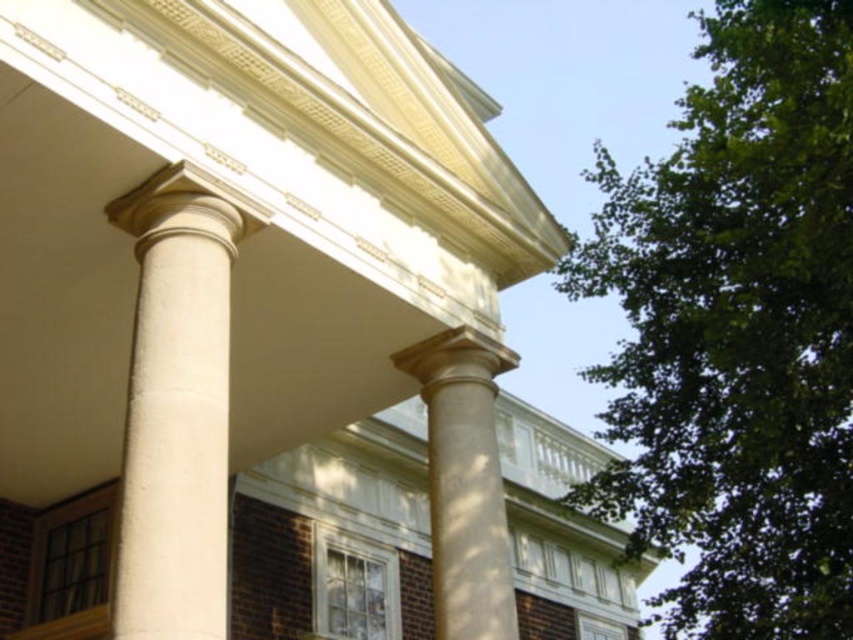
Who is lower down, green leafy tree at upper right or smooth beige column at center?

smooth beige column at center is lower down.

Is green leafy tree at upper right positioned in front of smooth beige column at center?

Yes.

At what (x,y) coordinates should I click in order to perform the action: click on green leafy tree at upper right. Please return your answer as a coordinate pair (x, y). The width and height of the screenshot is (853, 640). Looking at the image, I should click on (737, 330).

Does white stone column at left have a greater width compared to smooth beige column at center?

No.

Can you confirm if white stone column at left is positioned above smooth beige column at center?

Yes, white stone column at left is above smooth beige column at center.

Who is more forward, (165, 208) or (483, 413)?

Point (165, 208)

Locate an element on the screen. Image resolution: width=853 pixels, height=640 pixels. white stone column at left is located at coordinates (177, 404).

Is green leafy tree at upper right closer to the viewer compared to white stone column at left?

No, green leafy tree at upper right is further to the viewer.

Between green leafy tree at upper right and white stone column at left, which one has more height?

green leafy tree at upper right is taller.

What are the coordinates of `green leafy tree at upper right` in the screenshot? It's located at (737, 330).

The width and height of the screenshot is (853, 640). What are the coordinates of `green leafy tree at upper right` in the screenshot? It's located at (737, 330).